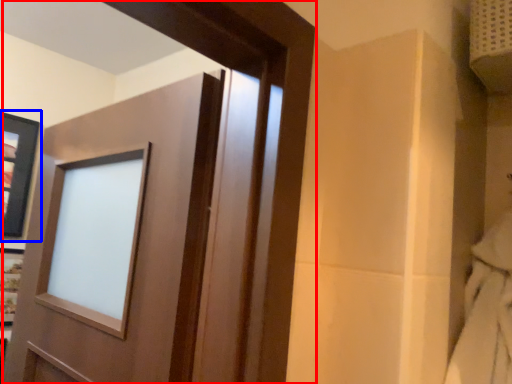
Question: Which point is closer to the camera, door (highlighted by a red box) or picture frame (highlighted by a blue box)?

Choices:
 (A) door
 (B) picture frame

Answer: (A)